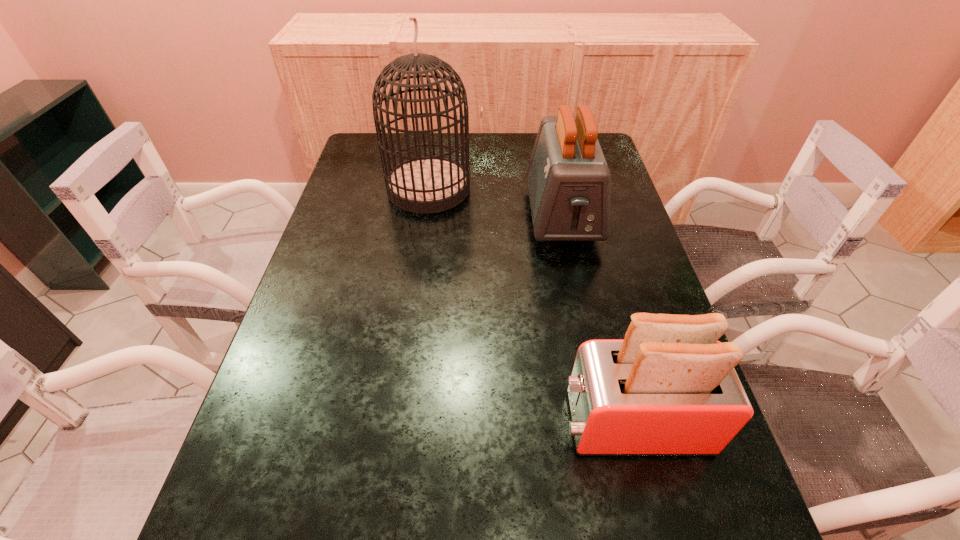
Where is `object present at the left edge`? The image size is (960, 540). object present at the left edge is located at coordinates (430, 184).

At what (x,y) coordinates should I click in order to perform the action: click on object that is at the far left corner. Please return your answer as a coordinate pair (x, y). The height and width of the screenshot is (540, 960). Looking at the image, I should click on (430, 184).

In the image, there is a desktop. Identify the location of vacant space at the far edge. The height and width of the screenshot is (540, 960). (459, 133).

At what (x,y) coordinates should I click in order to perform the action: click on free point at the left edge. Please return your answer as a coordinate pair (x, y). This screenshot has height=540, width=960. Looking at the image, I should click on (375, 253).

Locate an element on the screen. The image size is (960, 540). vacant position at the right edge of the desktop is located at coordinates pyautogui.click(x=667, y=500).

What are the coordinates of `free spot between the nearest object and the farther toaster` in the screenshot? It's located at (597, 319).

I want to click on free space between the birdcage and the nearest object, so click(x=531, y=305).

The height and width of the screenshot is (540, 960). What are the coordinates of `vacant space that's between the tallest object and the farther toaster` in the screenshot? It's located at (495, 202).

The image size is (960, 540). What are the coordinates of `free space that is in between the farther toaster and the nearer toaster` in the screenshot? It's located at (597, 319).

At what (x,y) coordinates should I click in order to perform the action: click on free spot between the nearest object and the farther toaster. Please return your answer as a coordinate pair (x, y). Looking at the image, I should click on (597, 319).